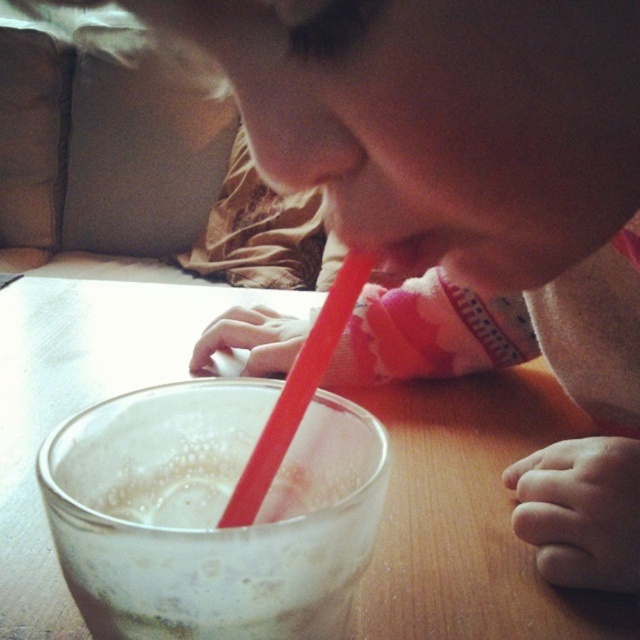
Which is in front, point (28, 524) or point (109, 483)?

Point (109, 483) is in front.

Does transparent glass table at center lie behind white frothy liquid at center?

That is True.

Is point (400, 442) farther from viewer compared to point (189, 536)?

Yes.

Where is `transparent glass table at center`? The height and width of the screenshot is (640, 640). transparent glass table at center is located at coordinates (470, 516).

Between white frothy liquid at center and rubberized red straw at center, which one appears on the left side from the viewer's perspective?

white frothy liquid at center is more to the left.

Does white frothy liquid at center appear on the right side of rubberized red straw at center?

In fact, white frothy liquid at center is to the left of rubberized red straw at center.

Is point (296, 602) positioned behind point (294, 385)?

No, it is in front of (294, 385).

At what (x,y) coordinates should I click in order to perform the action: click on white frothy liquid at center. Please return your answer as a coordinate pair (x, y). Looking at the image, I should click on (211, 513).

Is transparent glass table at center shorter than rubberized red straw at center?

No, transparent glass table at center is not shorter than rubberized red straw at center.

Looking at this image, does transparent glass table at center appear under rubberized red straw at center?

Yes, transparent glass table at center is below rubberized red straw at center.

Is point (480, 408) closer to camera compared to point (240, 476)?

No, it is behind (240, 476).

Find the location of a particular element. transparent glass table at center is located at coordinates (470, 516).